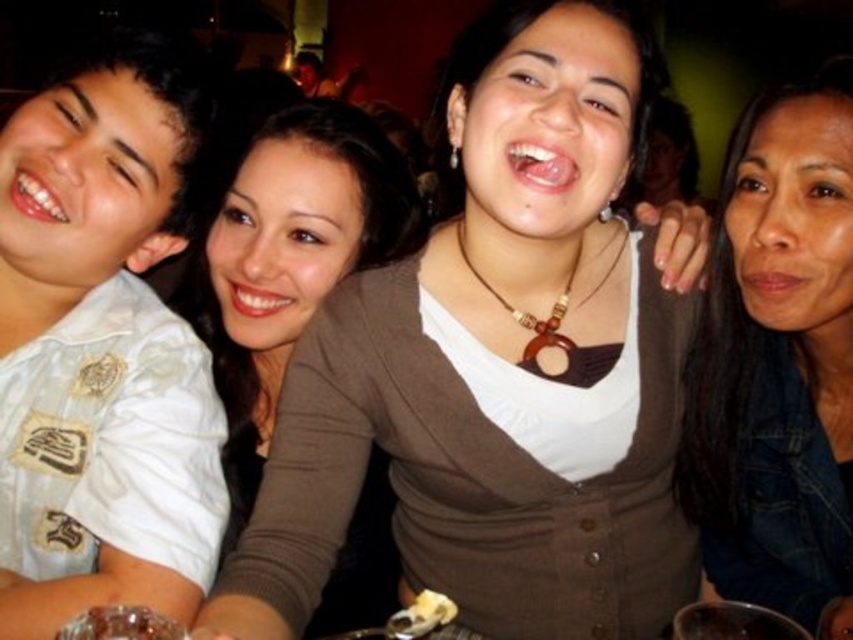
You are taking a photo of the group and want to focus on two specific points in the image. The first point is at coordinate point (804, 131) and the second is at coordinate point (210, 232). Which point should you focus on first to ensure the closest subject is in focus?

Point (804, 131) is closer to the camera than point (210, 232), so you should focus on point (804, 131) first to ensure the closest subject is in focus.

In the group photo, where is the denim jacket at lower right positioned relative to the brown matte sweater at center?

The denim jacket at lower right is to the right of the brown matte sweater at center.